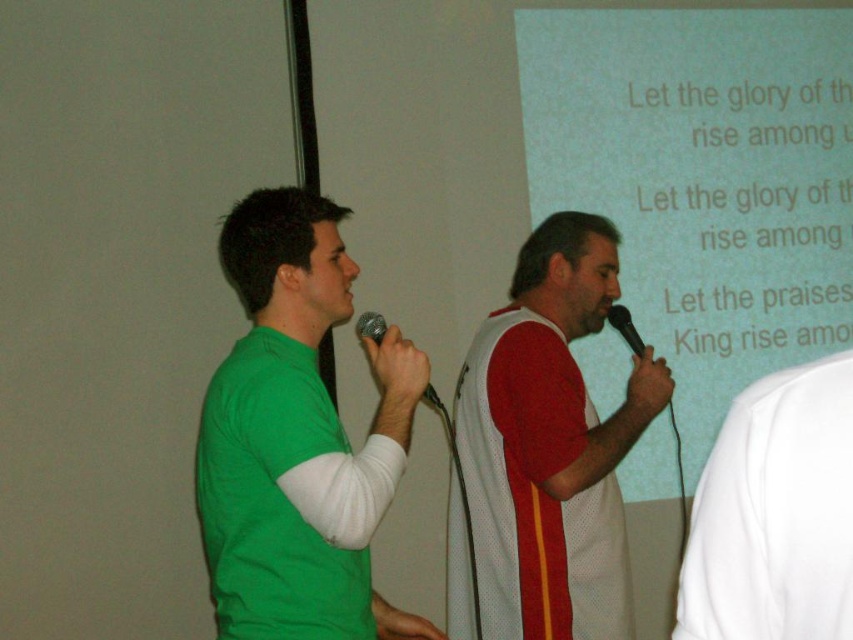
Measure the distance between point (318, 292) and camera.

They are 6.15 feet apart.

Is point (393, 333) positioned in front of point (442, 404)?

That is True.

You are a GUI agent. You are given a task and a screenshot of the screen. Output one action in this format:
    pyautogui.click(x=<x>, y=<y>)
    Task: Click on the green matte t-shirt at left
    The height and width of the screenshot is (640, 853).
    Given the screenshot: What is the action you would take?
    pyautogui.click(x=282, y=436)

Which is in front, point (804, 77) or point (827, 442)?

Point (827, 442)

How distant is white matte projection screen at upper center from white matte shirt at right?

They are 2.64 meters apart.

Does point (735, 108) come in front of point (802, 371)?

That is False.

Where is `white matte projection screen at upper center`? This screenshot has width=853, height=640. white matte projection screen at upper center is located at coordinates (703, 179).

Which is behind, point (223, 538) or point (572, 380)?

The point (572, 380) is behind.

What do you see at coordinates (282, 436) in the screenshot? I see `green matte t-shirt at left` at bounding box center [282, 436].

Locate an element on the screen. The width and height of the screenshot is (853, 640). green matte t-shirt at left is located at coordinates (282, 436).